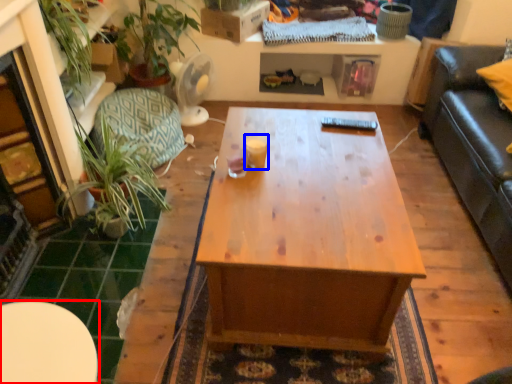
Question: Which point is further to the camera, table (highlighted by a red box) or coffee cup (highlighted by a blue box)?

Choices:
 (A) table
 (B) coffee cup

Answer: (B)